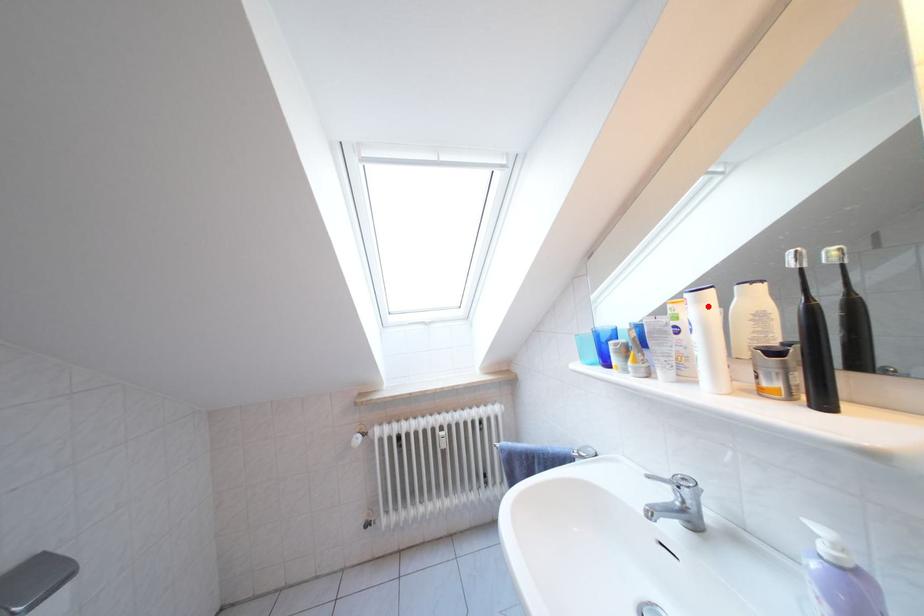
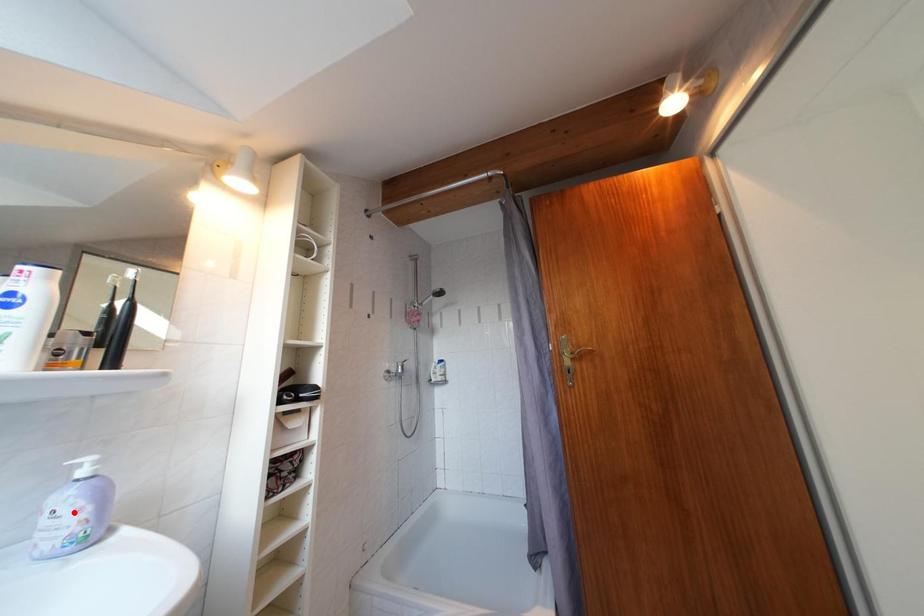
I am providing you with two images of the same scene from different viewpoints. A red point is marked on the first image and another point is marked on the second image. Does the point marked in image1 correspond to the same location as the one in image2?

No